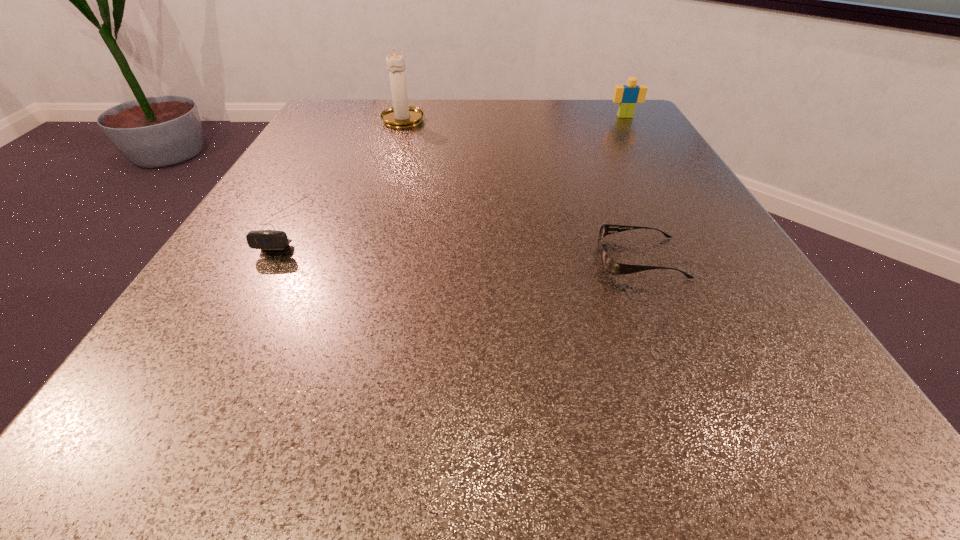
The width and height of the screenshot is (960, 540). Identify the location of sunglasses present at the right edge. 612,267.

This screenshot has width=960, height=540. I want to click on object present at the far left corner, so click(401, 115).

You are a GUI agent. You are given a task and a screenshot of the screen. Output one action in this format:
    pyautogui.click(x=<x>, y=<y>)
    Task: Click on the object at the far right corner
    This screenshot has width=960, height=540.
    Given the screenshot: What is the action you would take?
    pyautogui.click(x=627, y=96)

The image size is (960, 540). I want to click on vacant space at the far edge of the desktop, so click(563, 118).

Where is `vacant space at the near edge of the desktop`? vacant space at the near edge of the desktop is located at coordinates (301, 454).

Find the location of a particular element. This screenshot has width=960, height=540. blank area at the left edge is located at coordinates (269, 270).

Where is `free space at the right edge`? This screenshot has height=540, width=960. free space at the right edge is located at coordinates (660, 155).

Where is `free space at the far left corner of the desktop`? free space at the far left corner of the desktop is located at coordinates (361, 137).

The width and height of the screenshot is (960, 540). I want to click on free region at the near left corner of the desktop, so click(192, 400).

I want to click on vacant point at the near right corner, so click(811, 411).